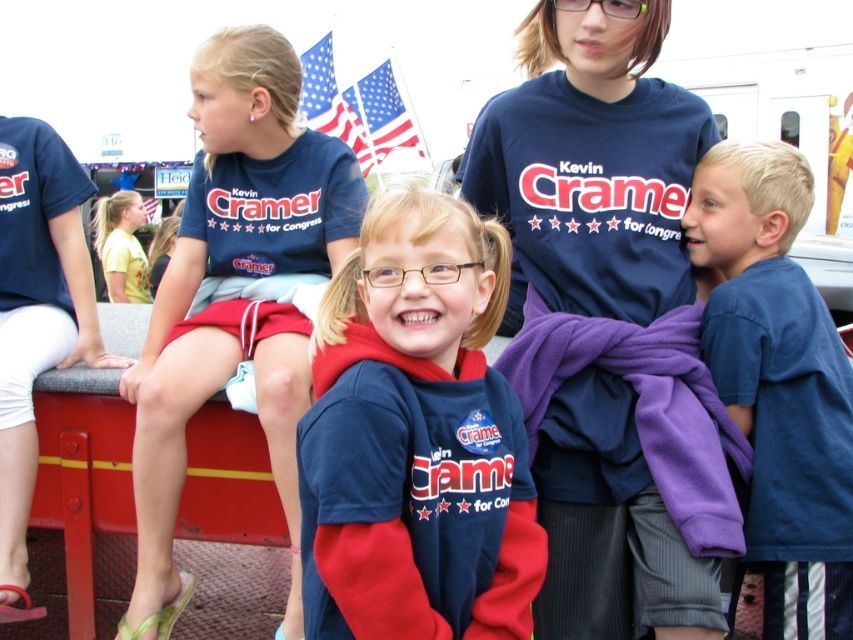
Between point (263, 177) and point (843, 600), which one is positioned behind?

Positioned behind is point (263, 177).

Is point (288, 380) positioned behind point (784, 326)?

Yes, it is behind point (784, 326).

Where is `matte blue t-shirt at upper left`? The image size is (853, 640). matte blue t-shirt at upper left is located at coordinates (236, 296).

This screenshot has height=640, width=853. Find the location of `matte blue t-shirt at upper left`. matte blue t-shirt at upper left is located at coordinates (236, 296).

Describe the element at coordinates (778, 381) in the screenshot. This screenshot has height=640, width=853. I see `blue cotton shirt at center` at that location.

At what (x,y) coordinates should I click in order to perform the action: click on blue cotton shirt at center. Please return your answer as a coordinate pair (x, y). Looking at the image, I should click on (778, 381).

Who is more forward, (804, 499) or (389, 140)?

Point (804, 499) is more forward.

Identify the location of blue cotton shirt at center. The width and height of the screenshot is (853, 640). (778, 381).

You are a GUI agent. You are given a task and a screenshot of the screen. Output one action in this format:
    pyautogui.click(x=<x>, y=<y>)
    Task: Click on the matte blue t-shirt at upper left
    The image size is (853, 640).
    Given the screenshot: What is the action you would take?
    pyautogui.click(x=236, y=296)

Based on the photo, does matte blue t-shirt at upper left appear over american flag at upper center?

No, matte blue t-shirt at upper left is not above american flag at upper center.

Is point (136, 637) farther from viewer compared to point (375, 161)?

That is False.

I want to click on matte blue t-shirt at upper left, so click(236, 296).